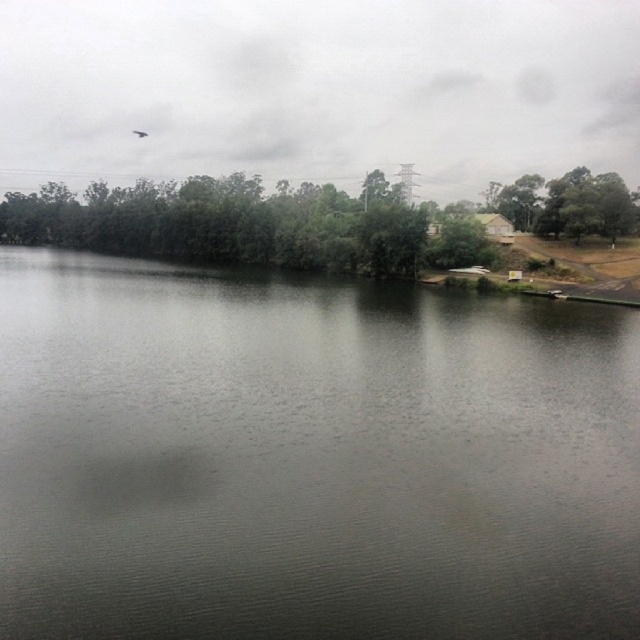
Question: Which point is farther to the camera?

Choices:
 (A) (358, 209)
 (B) (586, 228)
 (C) (342, 310)

Answer: (A)

Question: Is dark gray water at center thinner than green matte tree at upper right?

Choices:
 (A) yes
 (B) no

Answer: (B)

Question: Is green leafy trees at center positioned before green matte tree at upper right?

Choices:
 (A) no
 (B) yes

Answer: (B)

Question: Considering the real-world distances, which object is closest to the green leafy trees at center?

Choices:
 (A) green matte tree at upper right
 (B) dark gray water at center

Answer: (A)

Question: Is dark gray water at center further to the viewer compared to green leafy trees at center?

Choices:
 (A) yes
 (B) no

Answer: (B)

Question: Which point is farther to the camera?

Choices:
 (A) (632, 193)
 (B) (38, 348)
 (C) (12, 230)

Answer: (C)